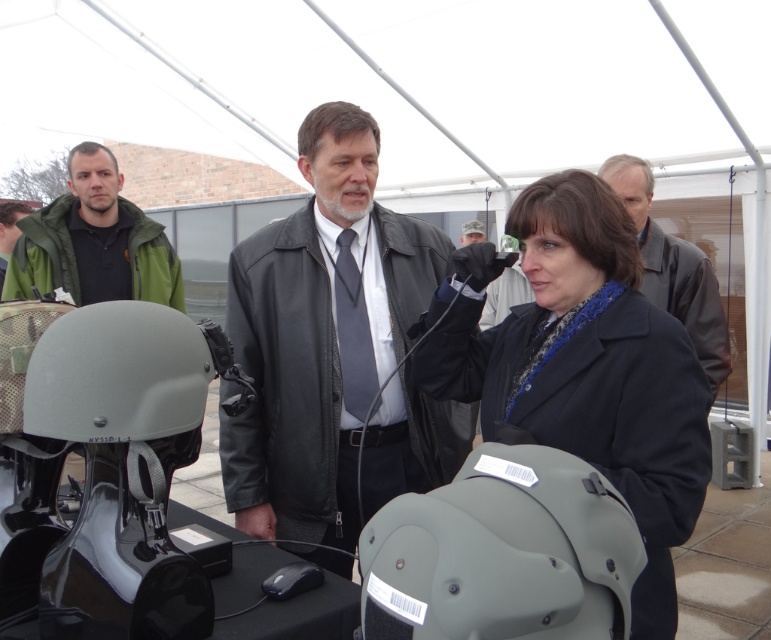
Question: Is matte black helmet at center above olive matte helmet at center?

Choices:
 (A) no
 (B) yes

Answer: (B)

Question: Does green matte jacket at upper left appear on the right side of leather jacket at upper right?

Choices:
 (A) no
 (B) yes

Answer: (A)

Question: Which of the following is the farthest from the observer?

Choices:
 (A) leather jacket at upper right
 (B) olive matte helmet at center
 (C) green fabric jacket at left
 (D) black leather jacket at center

Answer: (C)

Question: Which of the following is the farthest from the observer?

Choices:
 (A) (598, 540)
 (B) (12, 214)

Answer: (B)

Question: Is black leather jacket at center wider than leather jacket at upper right?

Choices:
 (A) yes
 (B) no

Answer: (A)

Question: Which of the following is the farthest from the observer?

Choices:
 (A) green fabric jacket at left
 (B) leather jacket at upper right

Answer: (A)